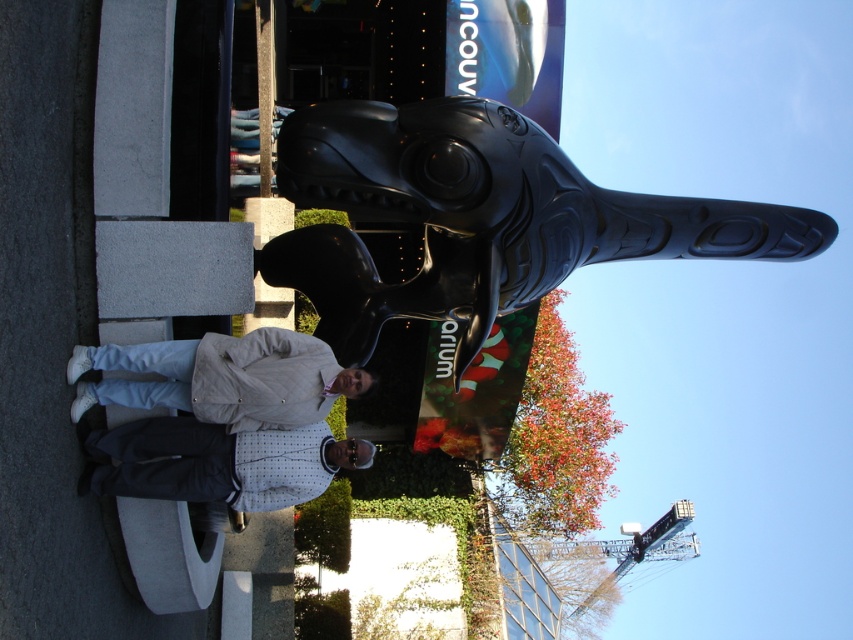
Does point (251, 332) lie behind point (213, 428)?

Yes, it is behind point (213, 428).

Which is more to the right, beige fabric jacket at lower center or white dotted fabric at center?

beige fabric jacket at lower center is more to the right.

This screenshot has width=853, height=640. In order to click on beige fabric jacket at lower center in this screenshot , I will do `click(224, 378)`.

In the scene shown: Does black polished whale at center have a greater height compared to beige fabric jacket at lower center?

Yes.

Image resolution: width=853 pixels, height=640 pixels. Describe the element at coordinates (480, 218) in the screenshot. I see `black polished whale at center` at that location.

Who is more forward, (503, 120) or (225, 419)?

Point (225, 419) is in front.

At what (x,y) coordinates should I click in order to perform the action: click on black polished whale at center. Please return your answer as a coordinate pair (x, y). The height and width of the screenshot is (640, 853). Looking at the image, I should click on (480, 218).

Which is more to the left, black polished whale at center or white dotted fabric at center?

white dotted fabric at center

Locate an element on the screen. The height and width of the screenshot is (640, 853). black polished whale at center is located at coordinates (480, 218).

You are a GUI agent. You are given a task and a screenshot of the screen. Output one action in this format:
    pyautogui.click(x=<x>, y=<y>)
    Task: Click on the black polished whale at center
    Image resolution: width=853 pixels, height=640 pixels.
    Given the screenshot: What is the action you would take?
    tap(480, 218)